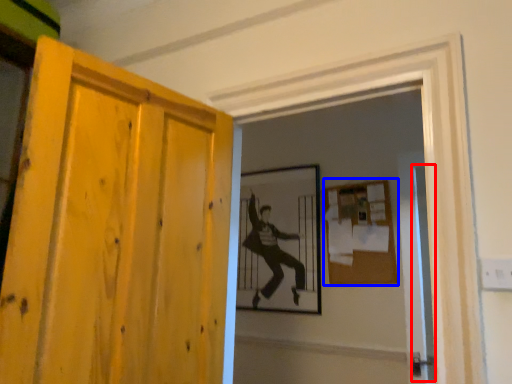
Question: Among these objects, which one is nearest to the camera, screen door (highlighted by a red box) or bulletin board (highlighted by a blue box)?

Choices:
 (A) screen door
 (B) bulletin board

Answer: (A)